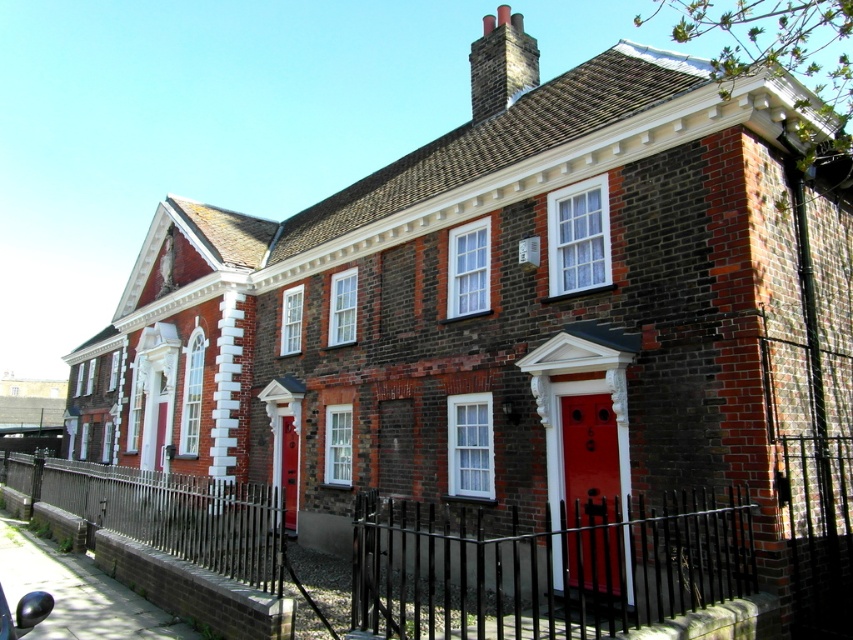
Question: Is smooth glossy red door at center to the left of matte red door at center from the viewer's perspective?

Choices:
 (A) no
 (B) yes

Answer: (A)

Question: Which object appears farthest from the camera in this image?

Choices:
 (A) matte red door at center
 (B) smooth glossy red door at center
 (C) black metal fence at lower center

Answer: (A)

Question: Which point is closer to the camera taking this photo?

Choices:
 (A) (26, 461)
 (B) (572, 467)
 (C) (280, 477)

Answer: (B)

Question: Which point appears farthest from the camera in this image?

Choices:
 (A) click(x=577, y=522)
 (B) click(x=287, y=433)

Answer: (B)

Question: Does black metal fence at lower center appear on the right side of matte red door at center?

Choices:
 (A) no
 (B) yes

Answer: (A)

Question: Does black metal fence at lower center appear on the left side of smooth glossy red door at center?

Choices:
 (A) no
 (B) yes

Answer: (B)